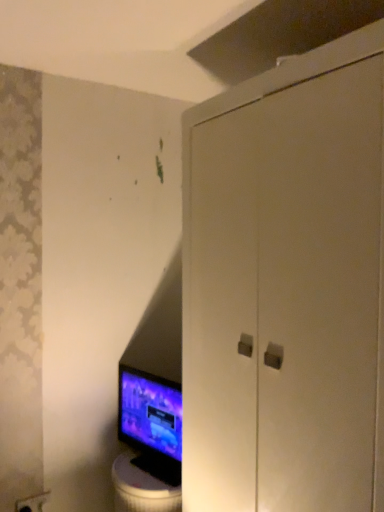
What is the approximate height of matte black tv at lower left?

matte black tv at lower left is 38.44 centimeters tall.

Measure the distance between matte black tv at lower left and camera.

matte black tv at lower left and camera are 1.77 meters apart from each other.

Describe the element at coordinates (151, 422) in the screenshot. I see `matte black tv at lower left` at that location.

Locate an element on the screen. matte black tv at lower left is located at coordinates (151, 422).

Find the location of a particular element. This screenshot has height=512, width=384. matte black tv at lower left is located at coordinates (151, 422).